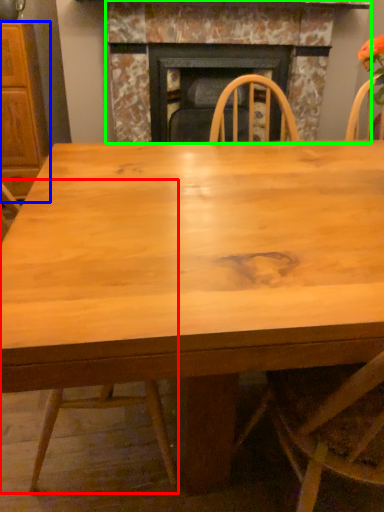
Question: Which is nearer to the chair (highlighted by a red box)? cabinetry (highlighted by a blue box) or fireplace (highlighted by a green box).

Choices:
 (A) cabinetry
 (B) fireplace

Answer: (A)